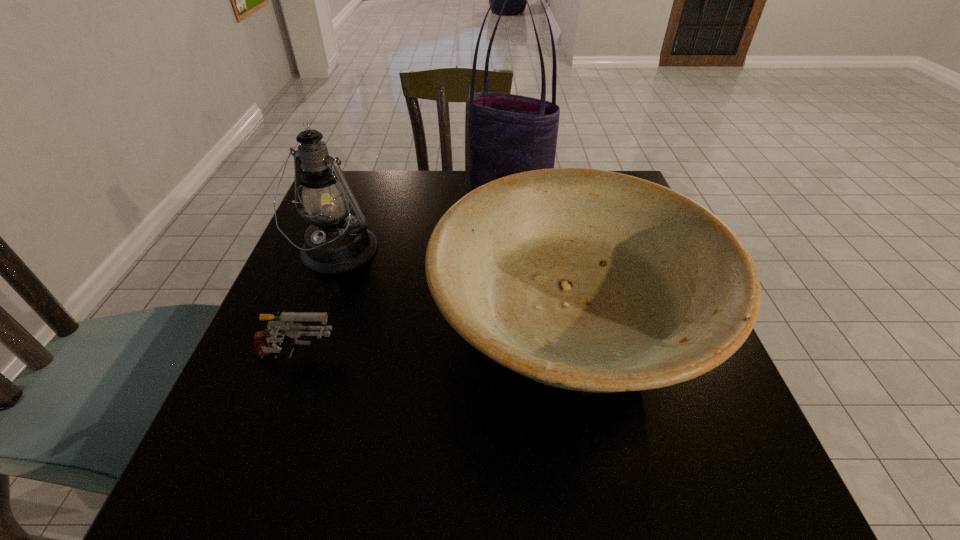
Locate an element on the screen. The width and height of the screenshot is (960, 540). tote bag is located at coordinates (507, 134).

Identify the location of the tallest object. (507, 134).

Where is `oil lamp`? oil lamp is located at coordinates (336, 242).

Identify the location of the second shortest object. The width and height of the screenshot is (960, 540). (589, 280).

Locate an element on the screen. gun is located at coordinates (x=284, y=323).

Image resolution: width=960 pixels, height=540 pixels. Identify the location of vacant area situated on the right of the tallest object. (626, 194).

At what (x,y) coordinates should I click in order to perform the action: click on blank area located 0.360m on the right of the second tallest object. Please return your answer as a coordinate pair (x, y). Looking at the image, I should click on (529, 253).

Find the location of a particular element. vacant region located 0.150m on the back of the third tallest object is located at coordinates (545, 212).

This screenshot has width=960, height=540. I want to click on vacant space situated at the barrel end of the gun, so click(x=396, y=358).

Identify the location of object present at the far edge. (507, 134).